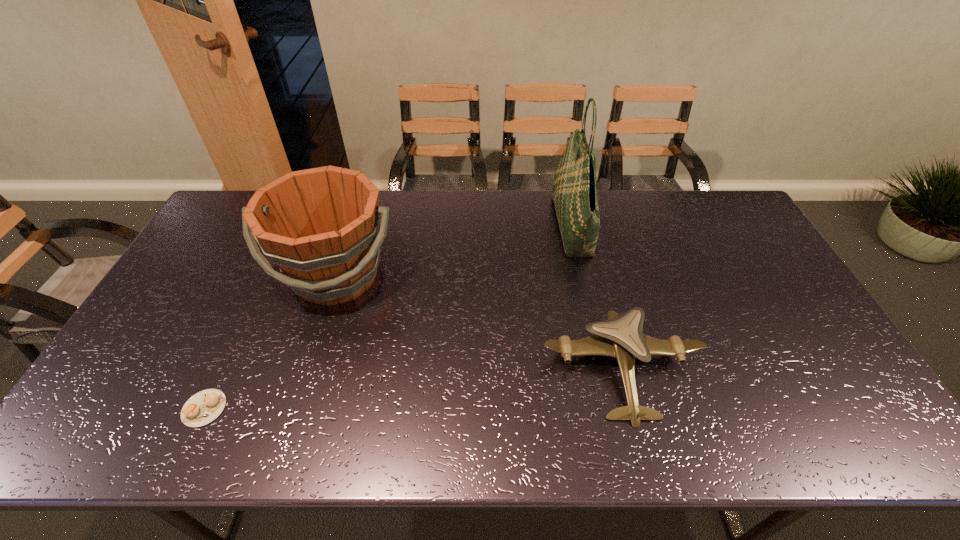
The image size is (960, 540). I want to click on the tallest object, so click(x=574, y=194).

In order to click on the third shortest object in this screenshot , I will do `click(323, 227)`.

At what (x,y) coordinates should I click in order to perform the action: click on the third tallest object. Please return your answer as a coordinate pair (x, y). The image size is (960, 540). Looking at the image, I should click on (622, 337).

Image resolution: width=960 pixels, height=540 pixels. I want to click on cappuccino, so click(x=205, y=406).

The width and height of the screenshot is (960, 540). I want to click on free space located on the left of the tallest object, so click(x=494, y=226).

Image resolution: width=960 pixels, height=540 pixels. What are the coordinates of `free space located on the handle side of the bucket` in the screenshot? It's located at (302, 387).

The height and width of the screenshot is (540, 960). In order to click on free spot located 0.250m on the right of the cappuccino in this screenshot , I will do `click(329, 408)`.

The height and width of the screenshot is (540, 960). In order to click on object located in the far edge section of the desktop in this screenshot , I will do `click(574, 194)`.

Identify the location of drone at the near edge. (622, 337).

Identify the location of cappuccino that is positioned at the near edge. (205, 406).